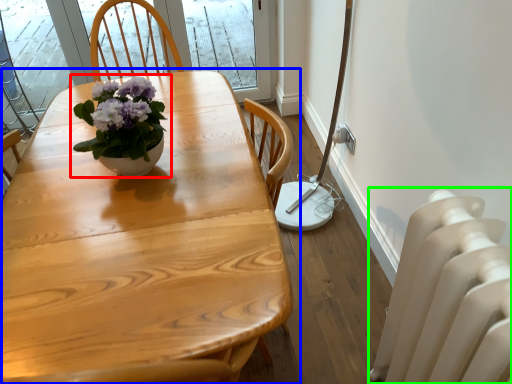
Question: Which object is the closest to the houseplant (highlighted by a red box)? Choose among these: table (highlighted by a blue box) or radiator (highlighted by a green box).

Choices:
 (A) table
 (B) radiator

Answer: (A)